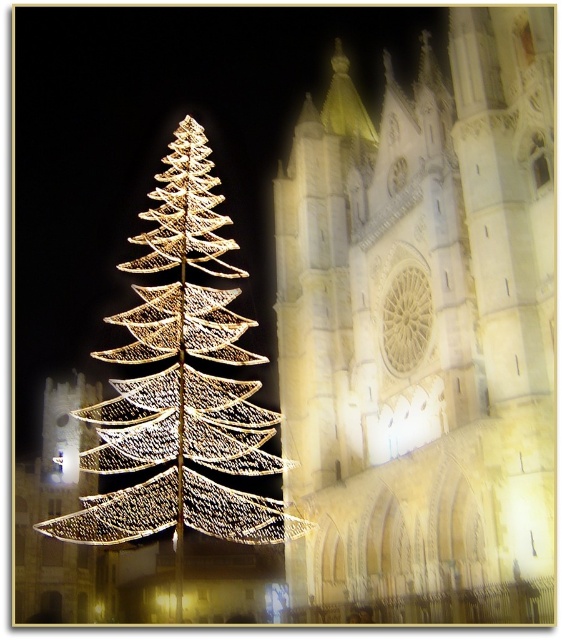
Does illuminated stone tower at center appear on the left side of illuminated wireframe at left?

In fact, illuminated stone tower at center is to the right of illuminated wireframe at left.

Between point (414, 156) and point (221, 397), which one is positioned in front?

Positioned in front is point (414, 156).

Locate an element on the screen. The image size is (562, 640). illuminated stone tower at center is located at coordinates (423, 321).